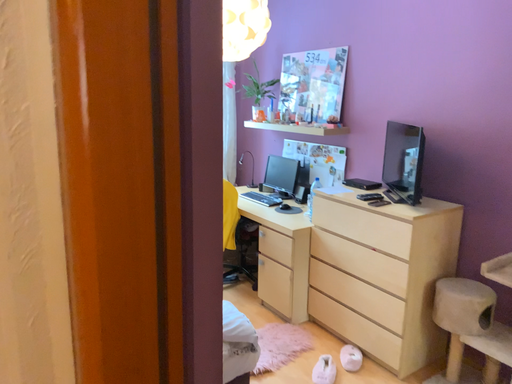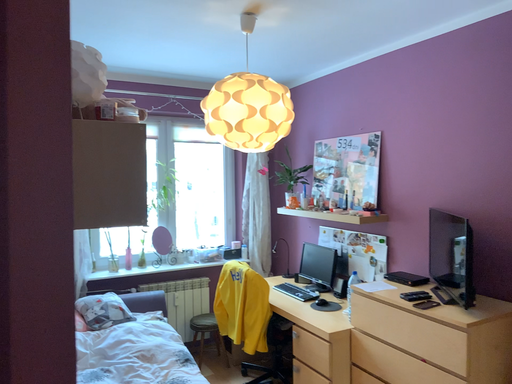
Question: Which way did the camera rotate in the video?

Choices:
 (A) rotated left
 (B) rotated right

Answer: (A)